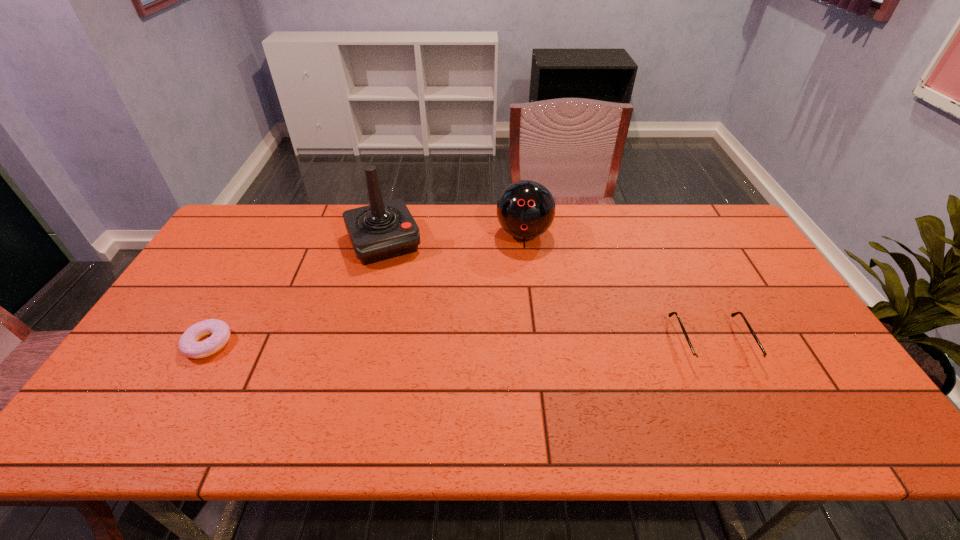
The width and height of the screenshot is (960, 540). In order to click on vacant space on the desktop that is between the doughnut and the third tallest object and is positioned on the front-facing side of the third object from right to left in this screenshot , I will do `click(430, 343)`.

You are a GUI agent. You are given a task and a screenshot of the screen. Output one action in this format:
    pyautogui.click(x=<x>, y=<y>)
    Task: Click on the vacant space on the desktop that is between the shortest object and the second shortest object and is positioned on the surface of the third shortest object near the finger holes
    The height and width of the screenshot is (540, 960).
    Given the screenshot: What is the action you would take?
    pyautogui.click(x=514, y=343)